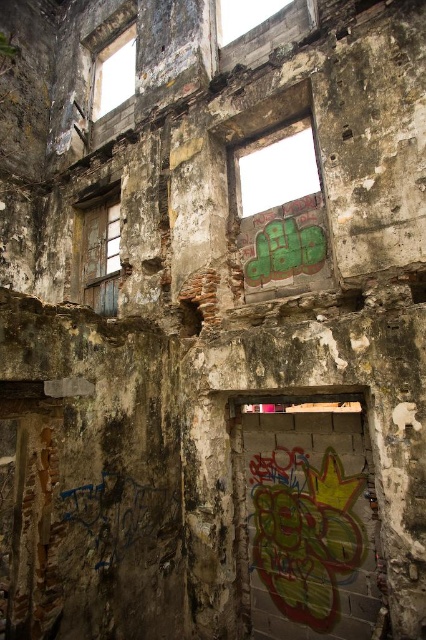
Question: Is wooden window at left above transparent glass window at upper left?

Choices:
 (A) no
 (B) yes

Answer: (A)

Question: Does wooden window at left have a smaller size compared to transparent glass window at upper left?

Choices:
 (A) yes
 (B) no

Answer: (A)

Question: Is wooden window at left closer to camera compared to transparent glass window at upper left?

Choices:
 (A) no
 (B) yes

Answer: (B)